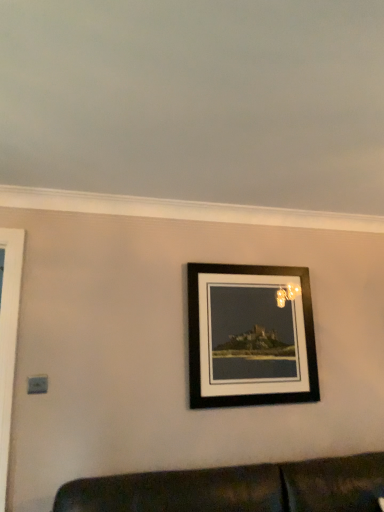
Measure the distance between black matte picture frame at center and camera.

The depth of black matte picture frame at center is 7.28 feet.

Locate an element on the screen. black matte picture frame at center is located at coordinates (250, 336).

This screenshot has width=384, height=512. What do you see at coordinates (250, 336) in the screenshot?
I see `black matte picture frame at center` at bounding box center [250, 336].

Find the location of a particular element. The height and width of the screenshot is (512, 384). black matte picture frame at center is located at coordinates (250, 336).